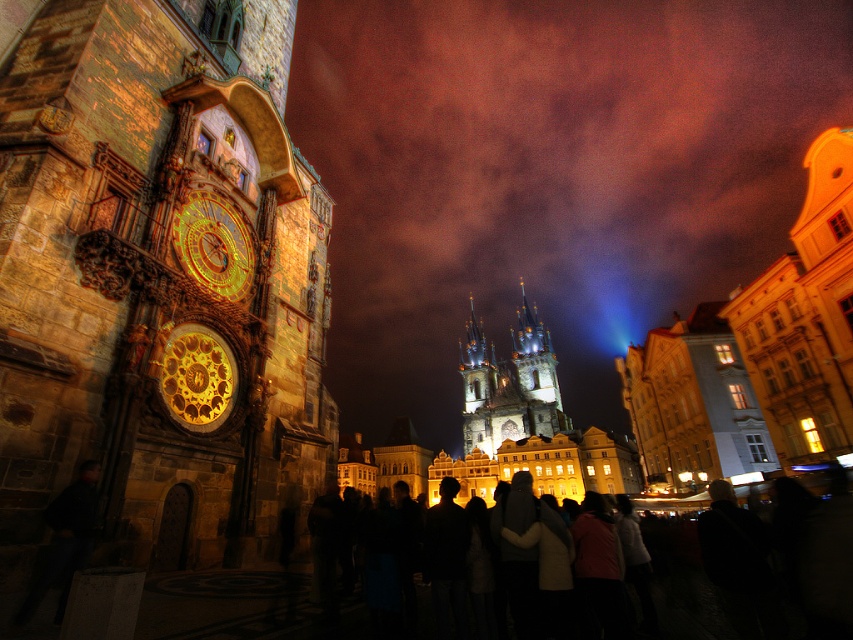
Does point (700, 529) come farther from viewer compared to point (517, 349)?

That is False.

Does dark clothing crowd at center appear on the left side of white stone bell tower at center?

Correct, you'll find dark clothing crowd at center to the left of white stone bell tower at center.

Between point (682, 534) and point (473, 412), which one is positioned in front?

Point (682, 534)

The image size is (853, 640). Find the location of `dark clothing crowd at center`. dark clothing crowd at center is located at coordinates (683, 580).

Is golden polished metal clock at left behind golden polished clock at left?

No, it is in front of golden polished clock at left.

The width and height of the screenshot is (853, 640). What are the coordinates of `golden polished metal clock at left` in the screenshot? It's located at (196, 376).

Which is in front, point (685, 572) or point (213, 289)?

Point (213, 289)

Does dark clothing crowd at center appear on the left side of golden polished clock at left?

No, dark clothing crowd at center is not to the left of golden polished clock at left.

Is point (677, 566) positioned after point (216, 196)?

Yes, it is.

Locate an element on the screen. The width and height of the screenshot is (853, 640). dark clothing crowd at center is located at coordinates (683, 580).